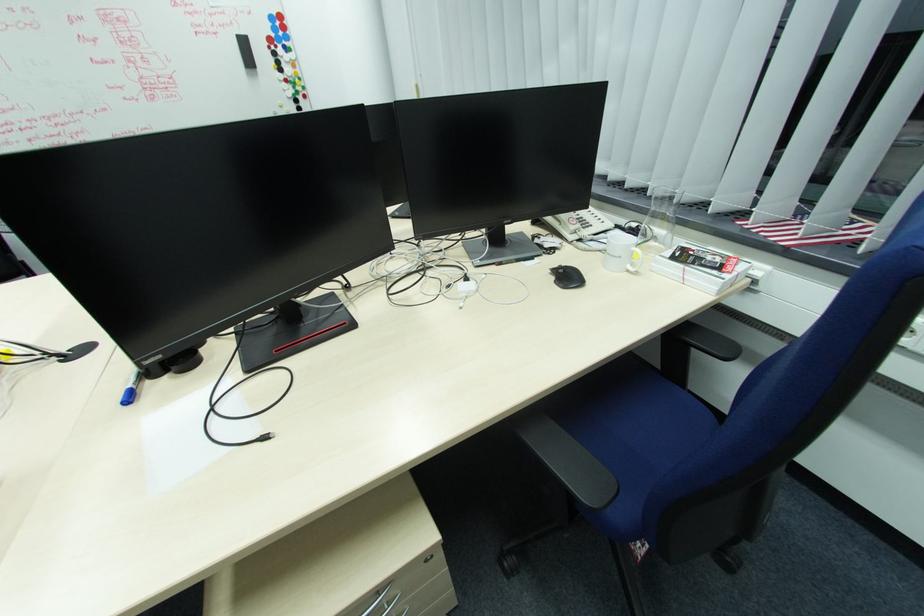
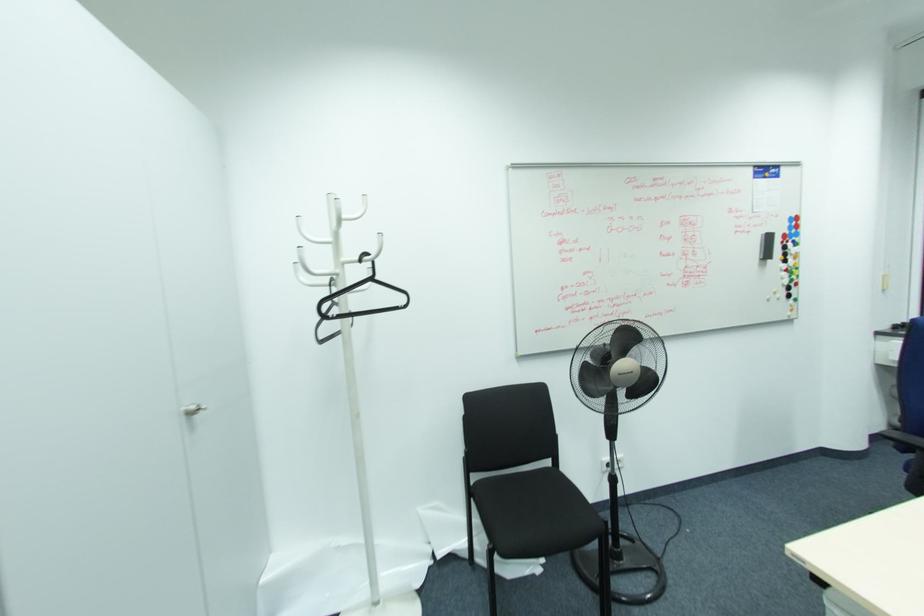
In the second image, find the point that corresponds to (x=286, y=44) in the first image.

(796, 238)